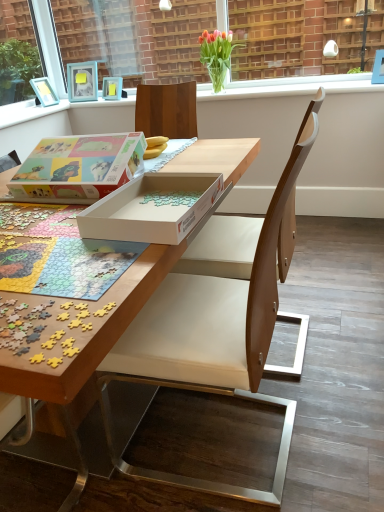
Question: Is clear glass window frame at upper center oriented towards pastel matte puzzle box at center?

Choices:
 (A) yes
 (B) no

Answer: (A)

Question: Considering the relative positions of clear glass window frame at upper center and pastel matte puzzle box at center in the image provided, is clear glass window frame at upper center to the left of pastel matte puzzle box at center from the viewer's perspective?

Choices:
 (A) no
 (B) yes

Answer: (A)

Question: Considering the relative positions of clear glass window frame at upper center and pastel matte puzzle box at center in the image provided, is clear glass window frame at upper center to the right of pastel matte puzzle box at center from the viewer's perspective?

Choices:
 (A) no
 (B) yes

Answer: (B)

Question: Is clear glass window frame at upper center smaller than pastel matte puzzle box at center?

Choices:
 (A) no
 (B) yes

Answer: (A)

Question: Is clear glass window frame at upper center positioned beyond the bounds of pastel matte puzzle box at center?

Choices:
 (A) no
 (B) yes

Answer: (B)

Question: In terms of width, does vivid tulips in glass vase at upper center look wider or thinner when compared to pastel matte puzzle box at center?

Choices:
 (A) thin
 (B) wide

Answer: (A)

Question: In the image, is vivid tulips in glass vase at upper center positioned in front of or behind pastel matte puzzle box at center?

Choices:
 (A) behind
 (B) front

Answer: (A)

Question: In the image, is vivid tulips in glass vase at upper center on the left side or the right side of pastel matte puzzle box at center?

Choices:
 (A) right
 (B) left

Answer: (A)

Question: From the image's perspective, is vivid tulips in glass vase at upper center above or below pastel matte puzzle box at center?

Choices:
 (A) below
 (B) above

Answer: (B)

Question: Based on their positions, is wooden puzzle pieces at center located to the left or right of wooden chair at center?

Choices:
 (A) right
 (B) left

Answer: (B)

Question: From the image's perspective, is wooden puzzle pieces at center located above or below wooden chair at center?

Choices:
 (A) below
 (B) above

Answer: (B)

Question: Looking at their shapes, would you say wooden puzzle pieces at center is wider or thinner than wooden chair at center?

Choices:
 (A) thin
 (B) wide

Answer: (B)

Question: Is point click(213, 152) closer or farther from the camera than point click(107, 399)?

Choices:
 (A) closer
 (B) farther

Answer: (B)

Question: From the image's perspective, relative to matte blue picture frame at upper left, is clear glass window frame at upper center above or below?

Choices:
 (A) below
 (B) above

Answer: (B)

Question: Relative to matte blue picture frame at upper left, is clear glass window frame at upper center in front or behind?

Choices:
 (A) behind
 (B) front

Answer: (B)